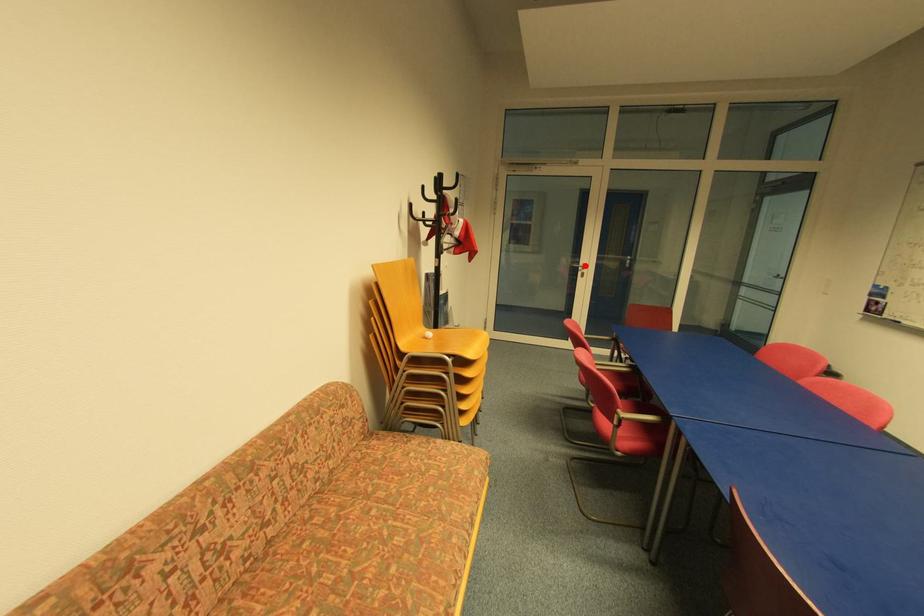
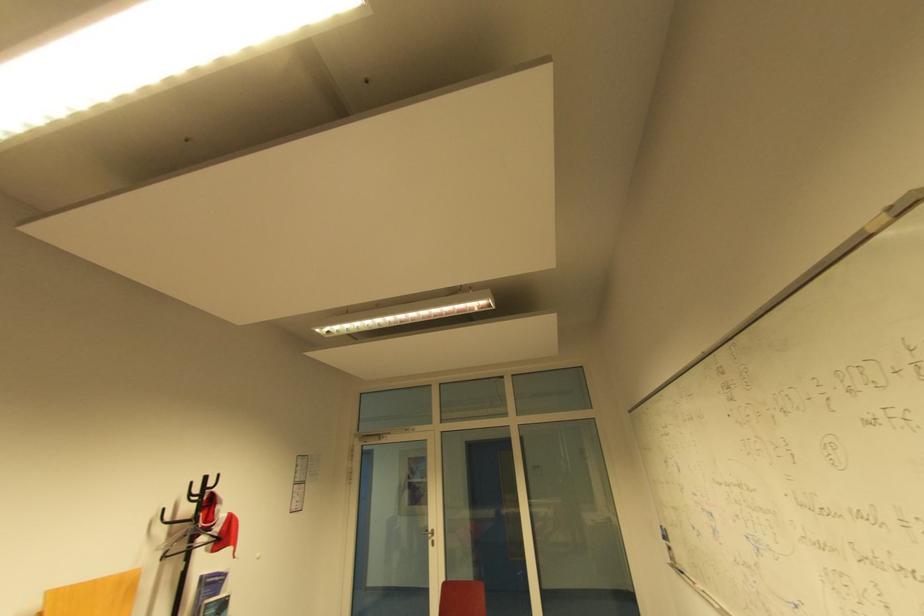
Find the pixel in the second image that matches the highlighted location in the first image.

(434, 531)